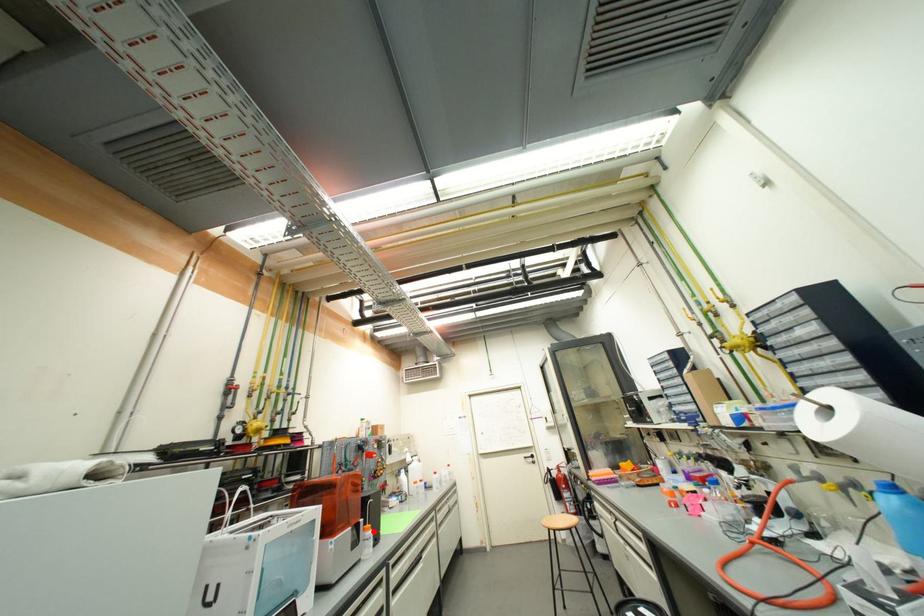
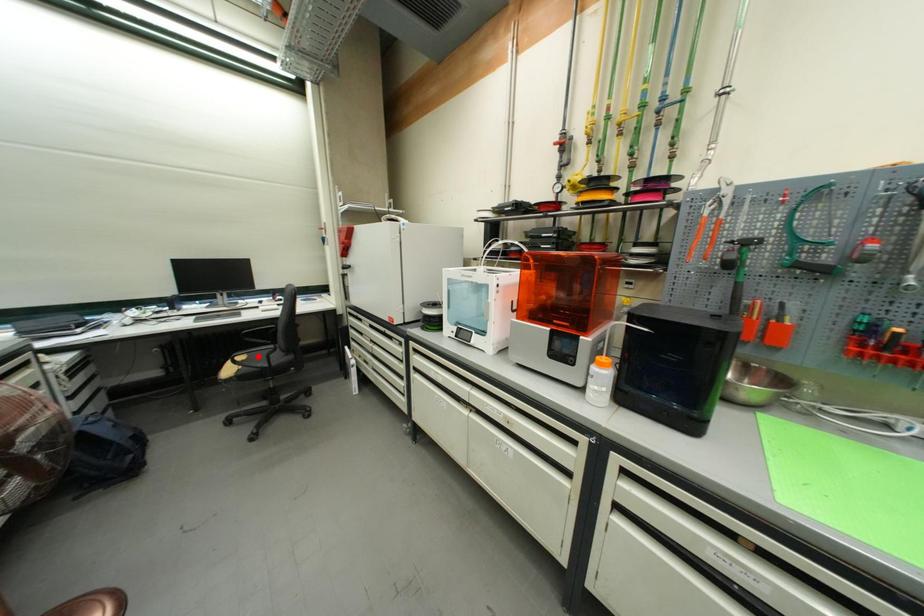
I am providing you with two images of the same scene from different viewpoints. A red point is marked on the first image and another point is marked on the second image. Is the red point in image1 aligned with the point shown in image2?

No